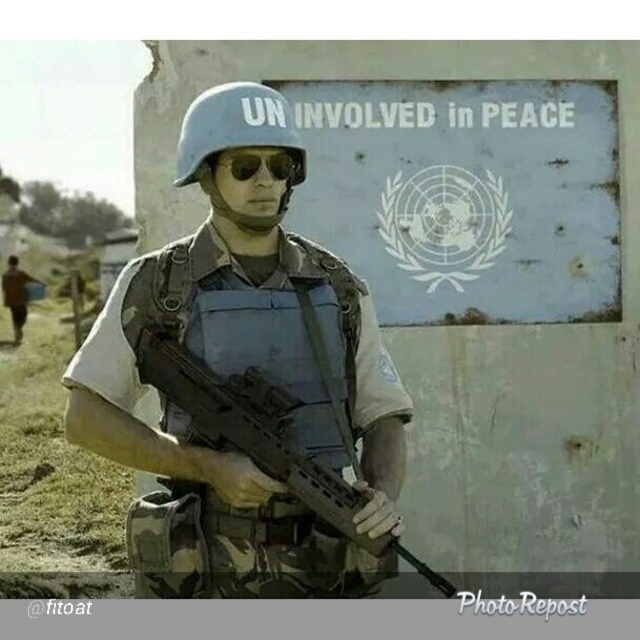
Is matte blue helmet at center bigger than matte black rifle at center?

Correct, matte blue helmet at center is larger in size than matte black rifle at center.

Is point (280, 572) behind point (276, 460)?

Yes, it is.

Is point (205, 317) closer to camera compared to point (208, 412)?

No.

Where is `matte blue helmet at center`? This screenshot has height=640, width=640. matte blue helmet at center is located at coordinates (241, 372).

Is matte blue helmet at center in front of sunglassestransparent at center?

Yes, matte blue helmet at center is in front of sunglassestransparent at center.

Does matte blue helmet at center appear over sunglassestransparent at center?

Actually, matte blue helmet at center is below sunglassestransparent at center.

I want to click on matte blue helmet at center, so click(x=241, y=372).

Does sunglassestransparent at center have a larger size compared to brown fabric shirt at lower left?

No, sunglassestransparent at center is not bigger than brown fabric shirt at lower left.

Does sunglassestransparent at center have a lesser width compared to brown fabric shirt at lower left?

A: Correct, sunglassestransparent at center's width is less than brown fabric shirt at lower left's.

Is point (296, 170) closer to viewer compared to point (12, 317)?

Yes, it is.

Where is `sunglassestransparent at center`? This screenshot has height=640, width=640. sunglassestransparent at center is located at coordinates (257, 163).